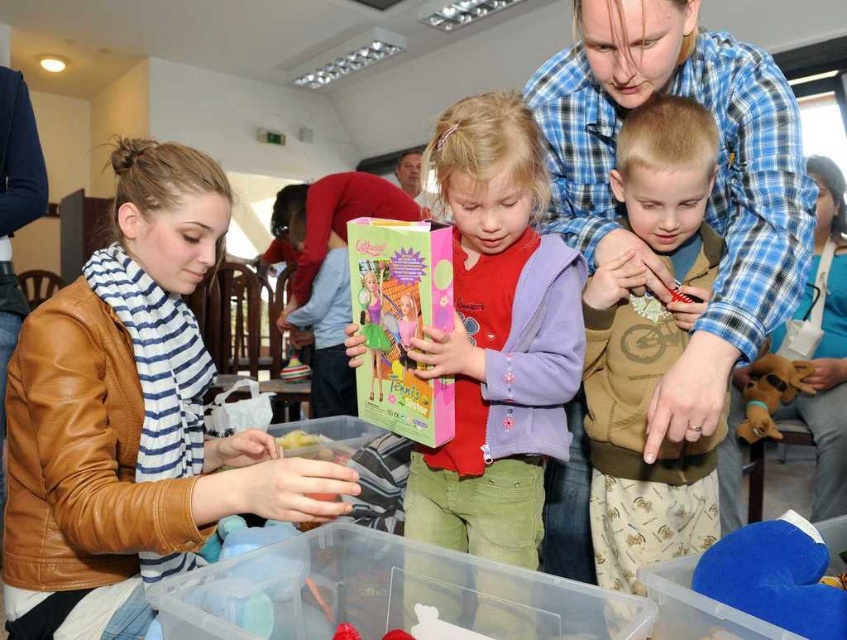
Question: Does pink cardboard box at center have a smaller size compared to brown cotton shirt at center?

Choices:
 (A) yes
 (B) no

Answer: (B)

Question: Which of these objects is positioned farthest from the blue plaid shirt at upper center?

Choices:
 (A) pink cardboard book at center
 (B) brown leather jacket at lower left
 (C) blue fabric purse at upper right
 (D) brown plush dog at lower right

Answer: (C)

Question: Among these objects, which one is farthest from the camera?

Choices:
 (A) blue plush toy at lower right
 (B) brown leather jacket at lower left
 (C) brown cotton shirt at center

Answer: (C)

Question: Is blue fabric purse at upper right behind blue plush toy at lower right?

Choices:
 (A) no
 (B) yes

Answer: (B)

Question: Based on their relative distances, which object is farther from the blue plush toy at lower right?

Choices:
 (A) blue fabric purse at upper right
 (B) smooth brown shirt at upper center

Answer: (A)

Question: Can you confirm if blue plaid shirt at upper center is positioned to the left of blue plush toy at lower right?

Choices:
 (A) no
 (B) yes

Answer: (B)